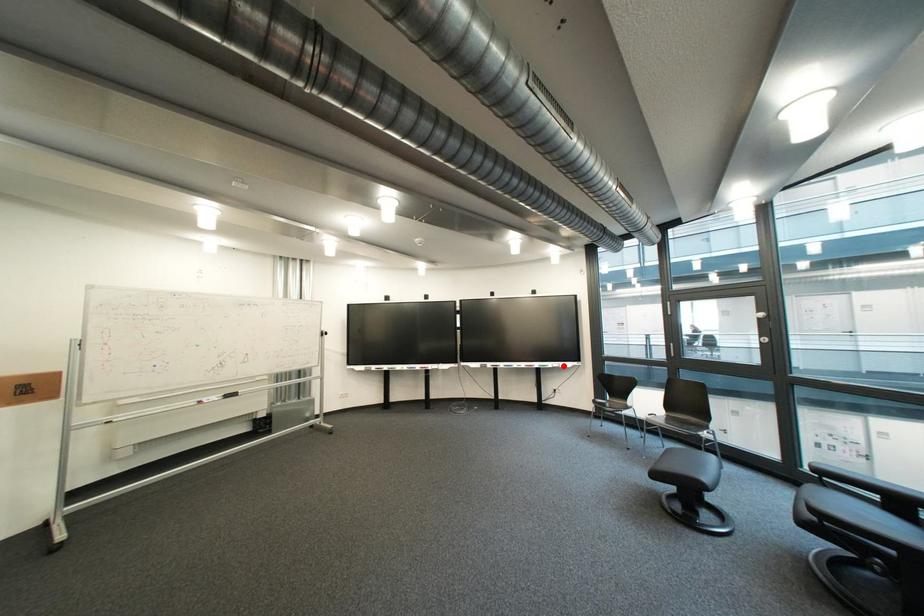
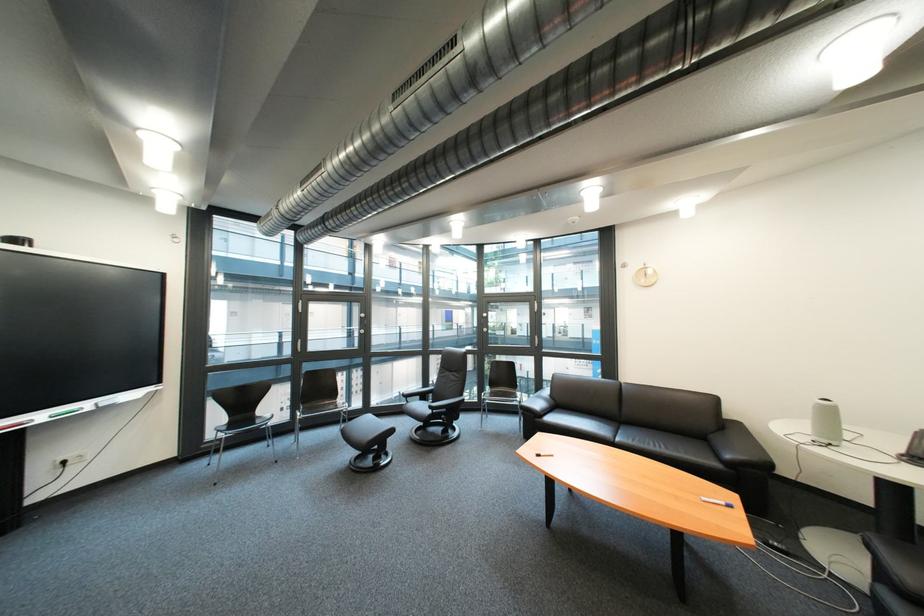
In the second image, find the point that corresponds to the highlighted location in the first image.

(101, 406)